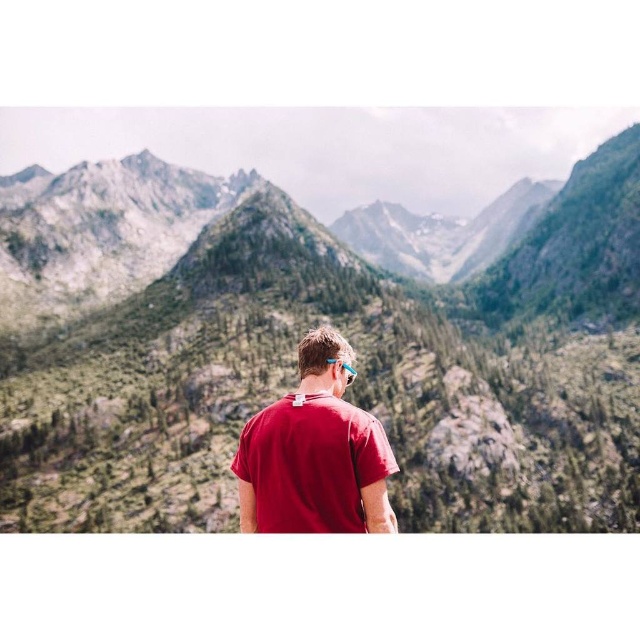
Question: Does green textured mountains at center have a larger size compared to matte red t-shirt at center?

Choices:
 (A) no
 (B) yes

Answer: (B)

Question: Is green textured mountains at center positioned behind blue rubber goggles at center?

Choices:
 (A) no
 (B) yes

Answer: (B)

Question: Which point is farther to the camera?

Choices:
 (A) (348, 380)
 (B) (605, 294)
 (C) (353, 531)

Answer: (B)

Question: Considering the real-world distances, which object is closest to the blue rubber goggles at center?

Choices:
 (A) green textured mountains at center
 (B) matte red t-shirt at center

Answer: (B)

Question: Is green textured mountains at center thinner than blue rubber goggles at center?

Choices:
 (A) no
 (B) yes

Answer: (A)

Question: Among these objects, which one is farthest from the camera?

Choices:
 (A) blue rubber goggles at center
 (B) matte red t-shirt at center
 (C) green textured mountains at center

Answer: (C)